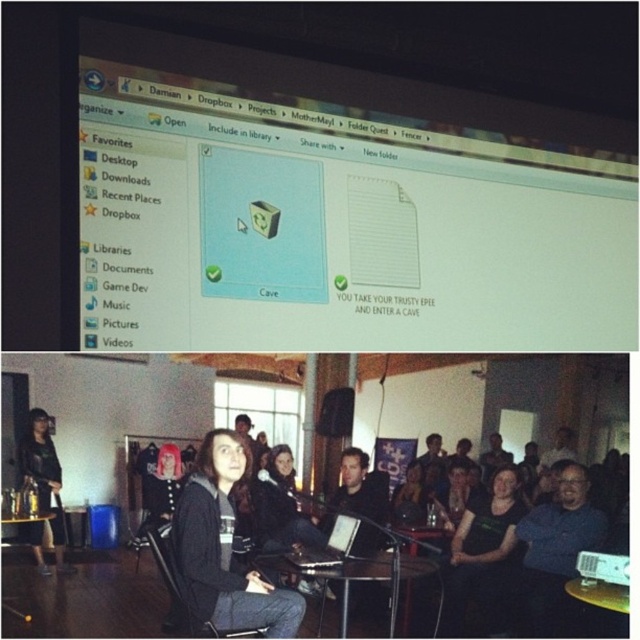
Question: Which object is positioned farthest from the black leather jacket at center?

Choices:
 (A) matte black jacket at center
 (B) black fabric speaker at center

Answer: (B)

Question: Is black leather jacket at center positioned before black fabric chair at center?

Choices:
 (A) no
 (B) yes

Answer: (B)

Question: Which object is the farthest from the black fabric speaker at center?

Choices:
 (A) black matte laptop at center
 (B) black fabric chair at center

Answer: (B)

Question: Which object is closer to the camera taking this photo?

Choices:
 (A) black matte laptop at center
 (B) black fabric chair at center

Answer: (B)

Question: Where is black fabric chair at center located in relation to white plastic projector at center in the image?

Choices:
 (A) above
 (B) below

Answer: (A)

Question: Observing the image, what is the correct spatial positioning of black matte laptop at center in reference to white plastic projector at center?

Choices:
 (A) left
 (B) right

Answer: (A)